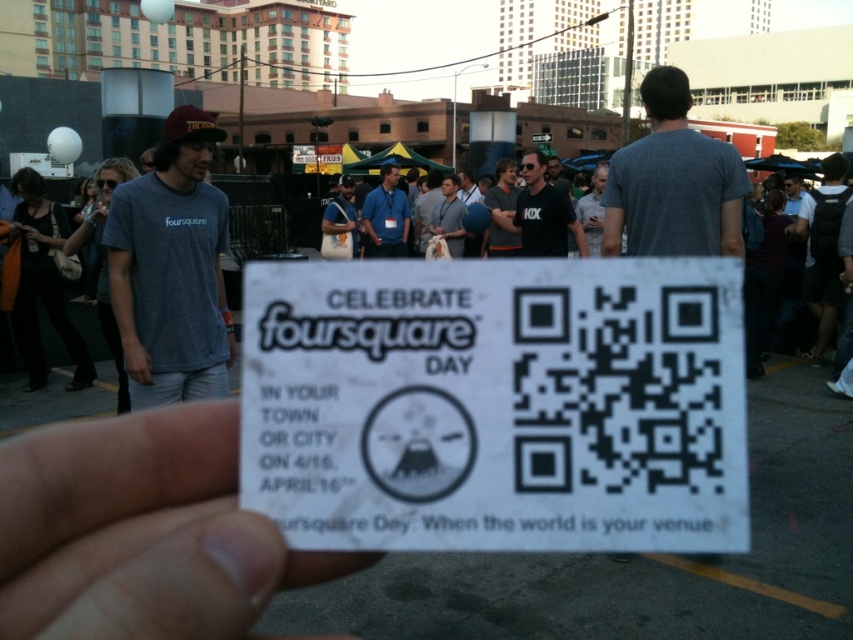
Between white paper qr code at center and black matte shirt at center, which one is positioned higher?

black matte shirt at center is higher up.

Find the location of a particular element. This screenshot has width=853, height=640. white paper qr code at center is located at coordinates (496, 404).

You are a GUI agent. You are given a task and a screenshot of the screen. Output one action in this format:
    pyautogui.click(x=<x>, y=<y>)
    Task: Click on the white paper qr code at center
    Image resolution: width=853 pixels, height=640 pixels.
    Given the screenshot: What is the action you would take?
    pyautogui.click(x=496, y=404)

The height and width of the screenshot is (640, 853). In order to click on white paper qr code at center in this screenshot , I will do pyautogui.click(x=496, y=404).

Image resolution: width=853 pixels, height=640 pixels. Describe the element at coordinates (496, 404) in the screenshot. I see `white paper qr code at center` at that location.

Between point (704, 280) and point (196, 529), which one is positioned in front?

Point (196, 529) is more forward.

Identify the location of white paper qr code at center. The height and width of the screenshot is (640, 853). (496, 404).

Does white paper at center have a smaller size compared to black matte shirt at center?

Correct, white paper at center occupies less space than black matte shirt at center.

Which is in front, point (192, 522) or point (572, 209)?

Point (192, 522)

Locate an element on the screen. white paper at center is located at coordinates (140, 531).

Locate an element on the screen. This screenshot has height=640, width=853. white paper at center is located at coordinates point(140,531).